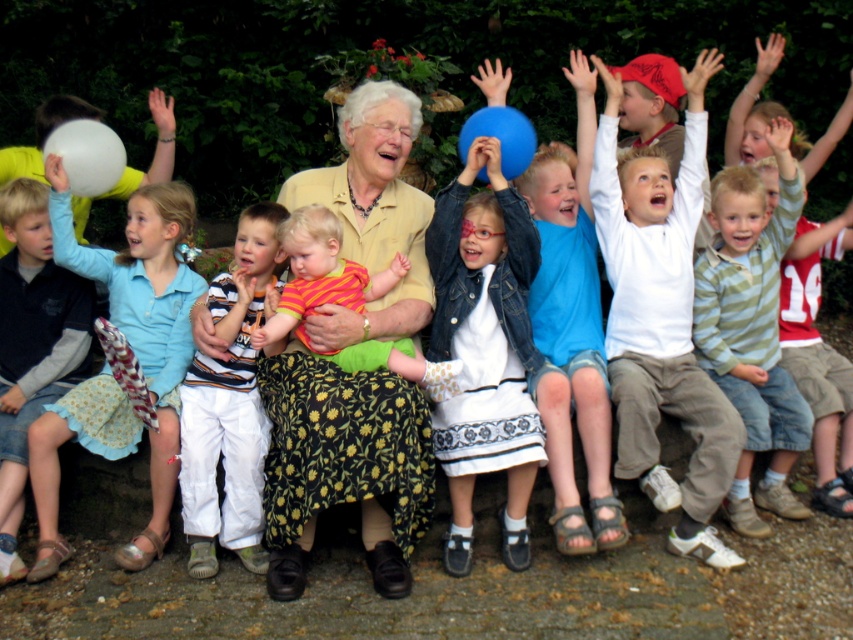
Can you confirm if matte yellow jacket at center is positioned below white matte balloon at left?

Correct, matte yellow jacket at center is located below white matte balloon at left.

Between point (287, 588) and point (97, 125), which one is positioned in front?

Point (287, 588) is in front.

Describe the element at coordinates (343, 465) in the screenshot. This screenshot has width=853, height=640. I see `matte yellow jacket at center` at that location.

The height and width of the screenshot is (640, 853). In order to click on matte yellow jacket at center in this screenshot , I will do `click(343, 465)`.

Based on the photo, does white zip-up hoodie at upper right appear on the right side of blue rubber balloon at upper center?

Yes, white zip-up hoodie at upper right is to the right of blue rubber balloon at upper center.

Is point (671, 392) less distant than point (509, 136)?

No.

Find the location of a particular element. The height and width of the screenshot is (640, 853). white zip-up hoodie at upper right is located at coordinates (660, 314).

Is matte yellow jacket at center below light blue cotton dress at left?

No.

Who is lower down, matte yellow jacket at center or light blue cotton dress at left?

Positioned lower is light blue cotton dress at left.

Find the location of a particular element. matte yellow jacket at center is located at coordinates tap(343, 465).